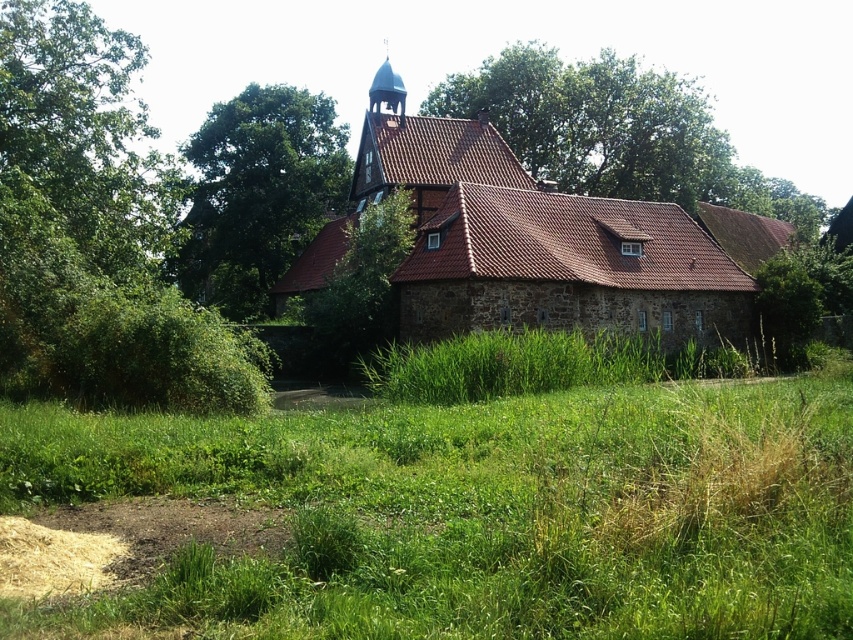
Is green leafy tree at upper left bigger than light brown shredded hay at lower left?

Yes, green leafy tree at upper left is bigger than light brown shredded hay at lower left.

Locate an element on the screen. This screenshot has width=853, height=640. green leafy tree at upper left is located at coordinates (258, 193).

Is green leafy tree at upper center bigger than light brown shredded hay at lower left?

Yes, green leafy tree at upper center is bigger than light brown shredded hay at lower left.

Where is `green leafy tree at upper center`? This screenshot has width=853, height=640. green leafy tree at upper center is located at coordinates (598, 124).

This screenshot has width=853, height=640. What do you see at coordinates (598, 124) in the screenshot? I see `green leafy tree at upper center` at bounding box center [598, 124].

This screenshot has width=853, height=640. Identify the location of green leafy tree at upper center. (598, 124).

Does green leafy tree at upper center appear on the right side of green leafy tree at upper left?

Indeed, green leafy tree at upper center is positioned on the right side of green leafy tree at upper left.

Can you confirm if green leafy tree at upper center is positioned below green leafy tree at upper left?

No.

Which is in front, point (643, 76) or point (230, 182)?

Positioned in front is point (230, 182).

Locate an element on the screen. This screenshot has height=640, width=853. green leafy tree at upper center is located at coordinates (598, 124).